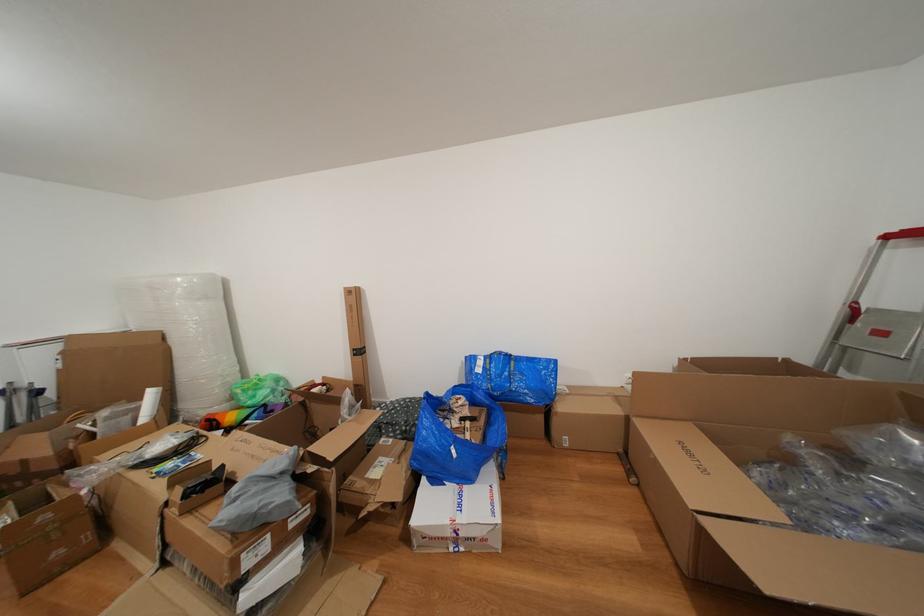
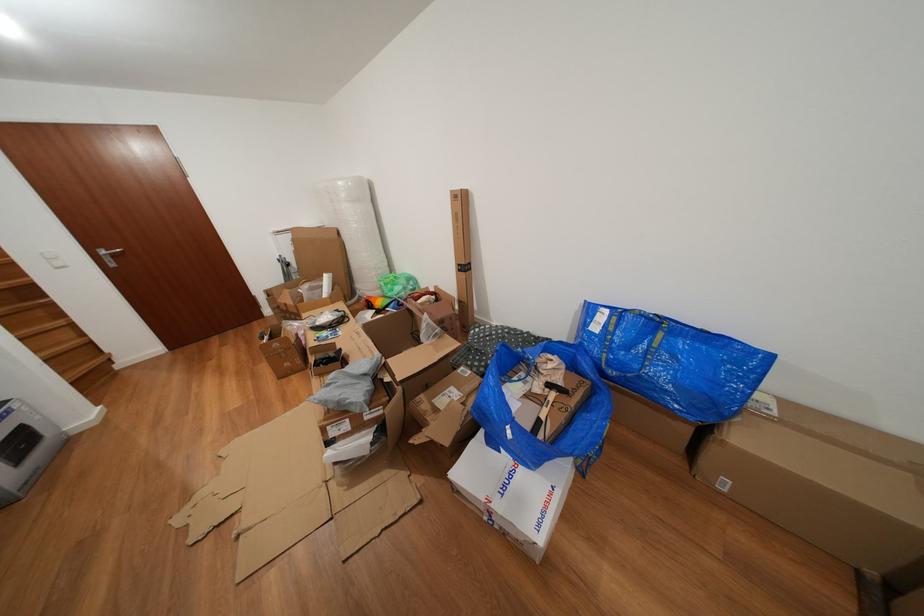
In the second image, find the point that corresponds to [517,362] in the first image.

(663, 328)